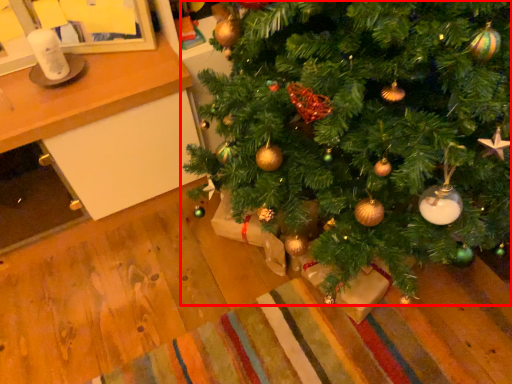
Question: From the image's perspective, considering the relative positions of christmas tree (annotated by the red box) and table in the image provided, where is christmas tree (annotated by the red box) located with respect to the staircase?

Choices:
 (A) below
 (B) above

Answer: (B)